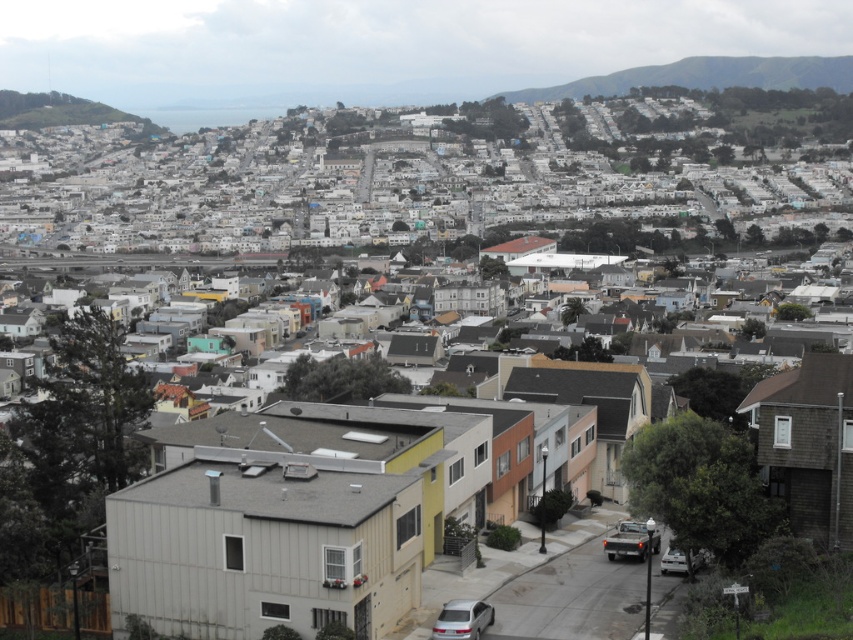
Question: Which object is closer to the camera taking this photo?

Choices:
 (A) silver metallic car at lower right
 (B) green grassy hillside at upper center
 (C) green grassy hillside at upper left
 (D) shiny silver car at lower center

Answer: (D)

Question: Where is green grassy hillside at upper center located in relation to satin silver sedan at lower center in the image?

Choices:
 (A) right
 (B) left

Answer: (A)

Question: Is satin silver sedan at lower center wider than silver metallic car at lower right?

Choices:
 (A) no
 (B) yes

Answer: (B)

Question: Estimate the real-world distances between objects in this image. Which object is closer to the satin silver sedan at lower center?

Choices:
 (A) green grassy hillside at upper left
 (B) shiny silver car at lower center
 (C) green grassy hillside at upper center
 (D) silver metallic car at lower right

Answer: (B)

Question: Can you confirm if green grassy hillside at upper center is wider than green grassy hillside at upper left?

Choices:
 (A) yes
 (B) no

Answer: (A)

Question: Among these points, which one is nearest to the camera?

Choices:
 (A) (672, 563)
 (B) (554, 92)
 (C) (457, 621)
 (D) (102, 120)

Answer: (C)